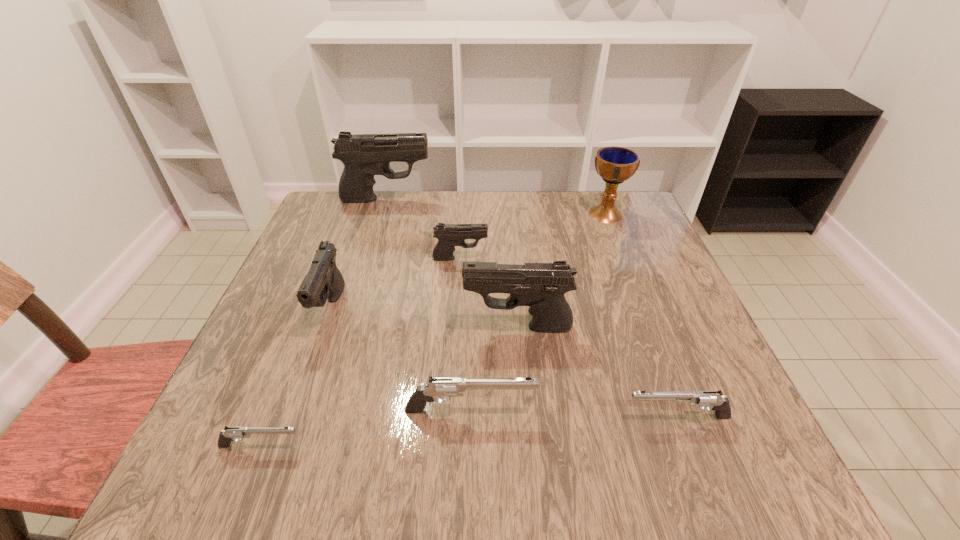
Identify which pistol is located as the second nearest to the farthest pistol. Please provide its 2D coordinates. Your answer should be formatted as a tuple, i.e. [(x, y)], where the tuple contains the x and y coordinates of a point satisfying the conditions above.

[(323, 281)]

At what (x,y) coordinates should I click in order to perform the action: click on the third closest pistol to the rightmost silver pistol. Please return your answer as a coordinate pair (x, y). This screenshot has height=540, width=960. Looking at the image, I should click on (449, 235).

Where is `black pistol that is the third closest to the farthest pistol`? Image resolution: width=960 pixels, height=540 pixels. black pistol that is the third closest to the farthest pistol is located at coordinates (541, 286).

Select which black pistol appears as the second closest to the second farthest black pistol. Please provide its 2D coordinates. Your answer should be formatted as a tuple, i.e. [(x, y)], where the tuple contains the x and y coordinates of a point satisfying the conditions above.

[(323, 281)]

Select which silver pistol is the closest to the nearest pistol. Please provide its 2D coordinates. Your answer should be formatted as a tuple, i.e. [(x, y)], where the tuple contains the x and y coordinates of a point satisfying the conditions above.

[(439, 387)]

Point out which silver pistol is positioned as the nearest to the rightmost pistol. Please provide its 2D coordinates. Your answer should be formatted as a tuple, i.e. [(x, y)], where the tuple contains the x and y coordinates of a point satisfying the conditions above.

[(439, 387)]

The height and width of the screenshot is (540, 960). Find the location of `vacant region that satisfies the following two spatial constraints: 1. at the barrel of the sixth nearest object; 2. at the barrel of the fifth shortest pistol`. vacant region that satisfies the following two spatial constraints: 1. at the barrel of the sixth nearest object; 2. at the barrel of the fifth shortest pistol is located at coordinates (457, 309).

Find the location of a particular element. The image size is (960, 540). free point that satisfies the following two spatial constraints: 1. at the barrel of the farthest black pistol; 2. at the barrel of the second smallest black pistol is located at coordinates (352, 309).

This screenshot has height=540, width=960. In order to click on free space in the image that satisfies the following two spatial constraints: 1. at the barrel of the farthest black pistol; 2. at the barrel of the fourth tallest object in this screenshot , I will do `click(352, 309)`.

This screenshot has width=960, height=540. What are the coordinates of `vacant region that satisfies the following two spatial constraints: 1. at the barrel of the farthest pistol; 2. at the barrel of the fourth tallest object` in the screenshot? It's located at (352, 309).